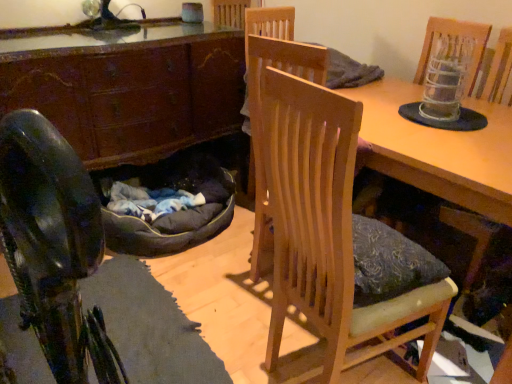
Question: Is wooden chair at center oriented towards wooden table at center?

Choices:
 (A) yes
 (B) no

Answer: (B)

Question: Is wooden chair at center at the left side of wooden table at center?

Choices:
 (A) no
 (B) yes

Answer: (B)

Question: From the image's perspective, is wooden chair at center under wooden table at center?

Choices:
 (A) yes
 (B) no

Answer: (A)

Question: Can wooden table at center be found inside wooden chair at center?

Choices:
 (A) no
 (B) yes

Answer: (A)

Question: Is wooden chair at center bigger than wooden table at center?

Choices:
 (A) yes
 (B) no

Answer: (A)

Question: From a real-world perspective, is dark brown wood cabinet at left positioned above or below wooden chair at center?

Choices:
 (A) below
 (B) above

Answer: (A)

Question: Relative to wooden chair at center, is dark brown wood cabinet at left in front or behind?

Choices:
 (A) front
 (B) behind

Answer: (B)

Question: Is dark brown wood cabinet at left bigger or smaller than wooden chair at center?

Choices:
 (A) small
 (B) big

Answer: (B)

Question: Is dark brown wood cabinet at left spatially inside wooden chair at center, or outside of it?

Choices:
 (A) outside
 (B) inside

Answer: (A)

Question: In terms of size, does dark gray fabric bean bag at lower left appear bigger or smaller than wooden chair at center?

Choices:
 (A) small
 (B) big

Answer: (A)

Question: From a real-world perspective, is dark gray fabric bean bag at lower left positioned above or below wooden chair at center?

Choices:
 (A) above
 (B) below

Answer: (B)

Question: Visually, is dark gray fabric bean bag at lower left positioned to the left or to the right of wooden chair at center?

Choices:
 (A) left
 (B) right

Answer: (A)

Question: Is dark gray fabric bean bag at lower left taller or shorter than wooden chair at center?

Choices:
 (A) tall
 (B) short

Answer: (B)

Question: Is point (153, 89) positioned closer to the camera than point (139, 231)?

Choices:
 (A) farther
 (B) closer

Answer: (A)

Question: Is dark brown wood cabinet at left inside or outside of dark gray fabric bean bag at lower left?

Choices:
 (A) outside
 (B) inside

Answer: (A)